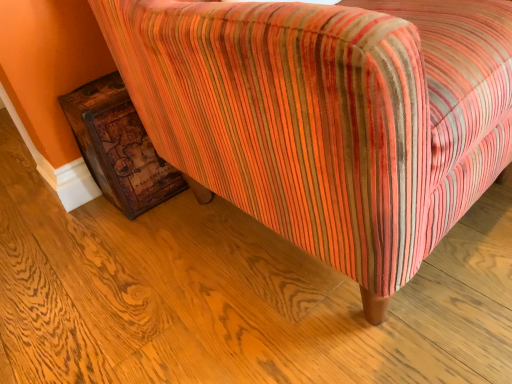
Image resolution: width=512 pixels, height=384 pixels. In order to click on vacant space to the right of distressed wood trunk at lower left in this screenshot , I will do `click(187, 201)`.